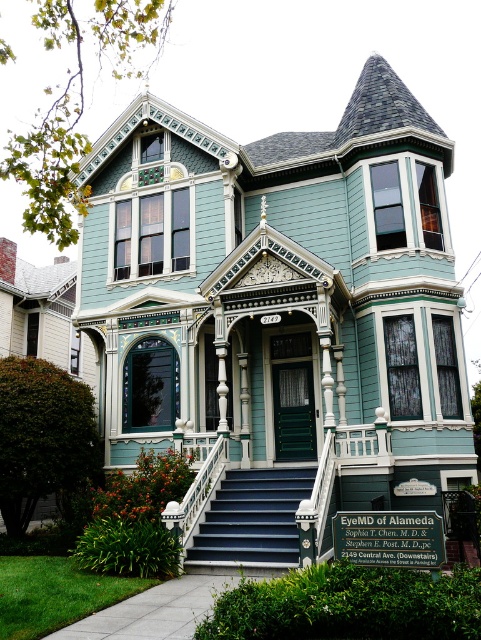
Does blue painted wood stairs at center have a greater width compared to white glossy balustrade at center?

Yes.

Which is below, blue painted wood stairs at center or white glossy balustrade at center?

blue painted wood stairs at center

The width and height of the screenshot is (481, 640). What are the coordinates of `blue painted wood stairs at center` in the screenshot? It's located at (253, 518).